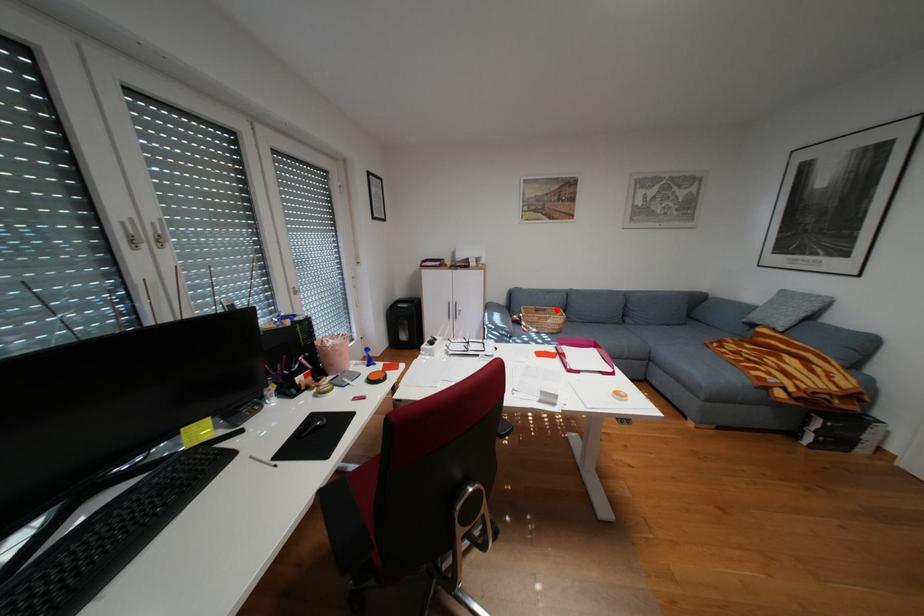
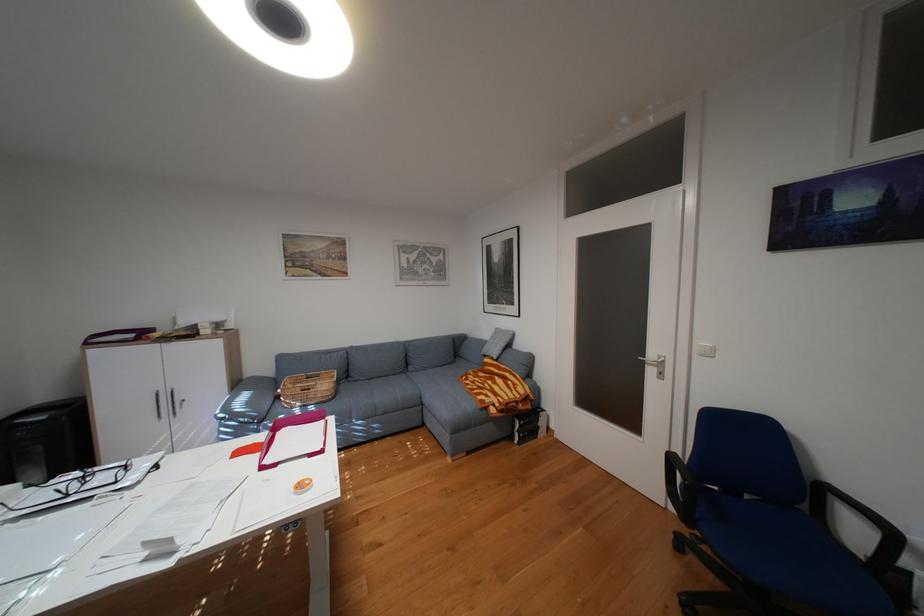
Find the pixel in the second image that matches the highlighted location in the first image.

(331, 375)